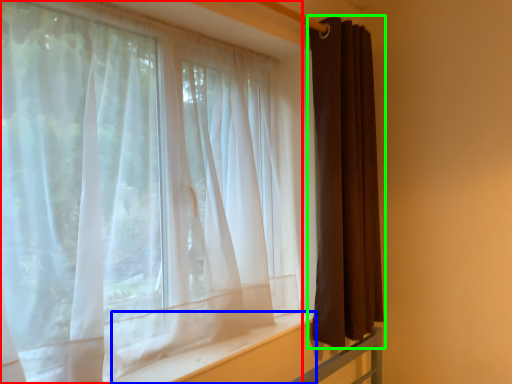
Question: Based on their relative distances, which object is farther from curtain (highlighted by a red box)? Choose from window sill (highlighted by a blue box) and curtain (highlighted by a green box).

Choices:
 (A) window sill
 (B) curtain

Answer: (B)